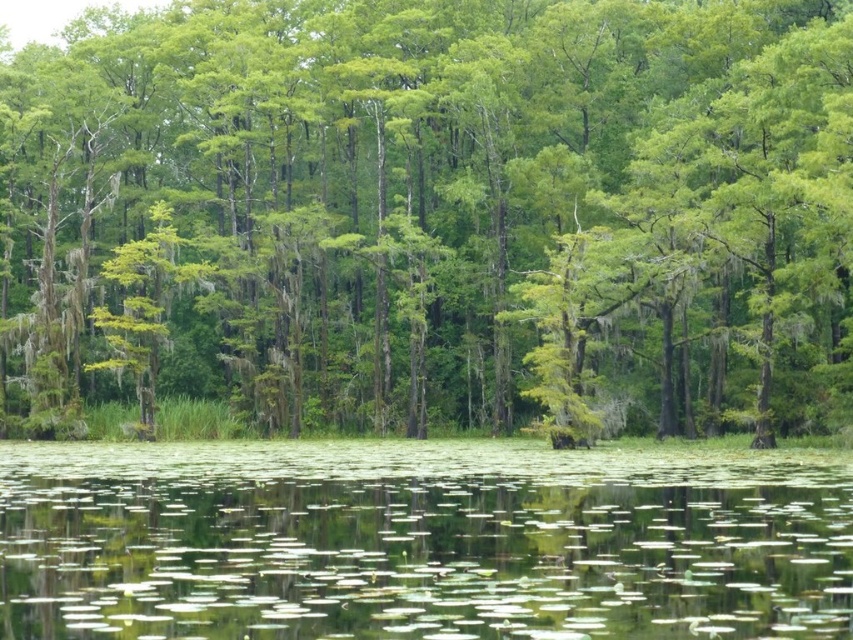
You are navigating a small boat in the swamp and need to reach a destination located at point (389, 612). There are two points marked in the scene. Which point is closer to your starting position at point (305, 252)?

Point (305, 252) is behind point (389, 612), so the closer point to your starting position is point (389, 612).

You are a bird flying over the swamp. You see the green mossy tree at center and the green lily pads at center. Which one is higher from the water surface?

The green mossy tree at center is above the green lily pads at center, so the green mossy tree at center is higher from the water surface.